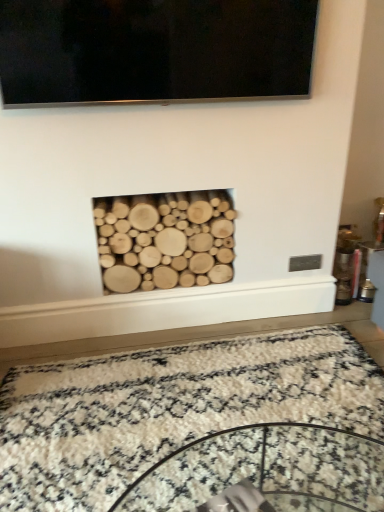
Describe the element at coordinates (169, 409) in the screenshot. This screenshot has height=512, width=384. I see `white shaggy rug at center` at that location.

This screenshot has height=512, width=384. Find the location of `white shaggy rug at center`. white shaggy rug at center is located at coordinates (169, 409).

From a real-world perspective, is black glossy flat-screen tv at upper center over white shaggy rug at center?

Yes.

Consider the image. From the image's perspective, relative to white shaggy rug at center, is black glossy flat-screen tv at upper center above or below?

black glossy flat-screen tv at upper center is situated higher than white shaggy rug at center in the image.

How many degrees apart are the facing directions of black glossy flat-screen tv at upper center and white shaggy rug at center?

0.0748 degrees separate the facing orientations of black glossy flat-screen tv at upper center and white shaggy rug at center.

Would you say black glossy flat-screen tv at upper center is outside white shaggy rug at center?

black glossy flat-screen tv at upper center is positioned outside white shaggy rug at center.

Between natural wood logs at center and white shaggy rug at center, which one appears on the left side from the viewer's perspective?

From the viewer's perspective, natural wood logs at center appears more on the left side.

Based on the photo, which is closer, (128, 209) or (315, 371)?

The point (315, 371) is closer.

Can you tell me how much natural wood logs at center and white shaggy rug at center differ in facing direction?

0.419 degrees.

Is white shaggy rug at center inside natural wood logs at center?

No, white shaggy rug at center is not surrounded by natural wood logs at center.

From a real-world perspective, relative to natural wood logs at center, is black glossy flat-screen tv at upper center vertically above or below?

In terms of real-world spatial position, black glossy flat-screen tv at upper center is above natural wood logs at center.

Consider the image. Considering the relative positions of black glossy flat-screen tv at upper center and natural wood logs at center in the image provided, is black glossy flat-screen tv at upper center to the right of natural wood logs at center from the viewer's perspective?

Yes, black glossy flat-screen tv at upper center is to the right of natural wood logs at center.

Considering the points (22, 86) and (219, 280), which point is in front, point (22, 86) or point (219, 280)?

The point (22, 86) is closer to the camera.

Does black glossy flat-screen tv at upper center lie behind natural wood logs at center?

No, the depth of black glossy flat-screen tv at upper center is less than that of natural wood logs at center.

From the image's perspective, which one is positioned higher, natural wood logs at center or black glossy flat-screen tv at upper center?

black glossy flat-screen tv at upper center appears higher in the image.

Considering the relative positions of natural wood logs at center and black glossy flat-screen tv at upper center in the image provided, is natural wood logs at center to the right of black glossy flat-screen tv at upper center from the viewer's perspective?

In fact, natural wood logs at center is to the left of black glossy flat-screen tv at upper center.

From a real-world perspective, is natural wood logs at center below black glossy flat-screen tv at upper center?

Indeed, from a real-world perspective, natural wood logs at center is positioned beneath black glossy flat-screen tv at upper center.

Identify the location of mat located below the natural wood logs at center (from the image's perspective). This screenshot has height=512, width=384. (169, 409).

Consider the image. Would you consider white shaggy rug at center to be distant from natural wood logs at center?

No, white shaggy rug at center is not far away from natural wood logs at center.

Measure the distance from white shaggy rug at center to natural wood logs at center.

21.86 inches.

Is white shaggy rug at center oriented towards natural wood logs at center?

No, white shaggy rug at center is not oriented towards natural wood logs at center.

Is white shaggy rug at center located outside black glossy flat-screen tv at upper center?

Yes, white shaggy rug at center is not within black glossy flat-screen tv at upper center.

At what (x,y) coordinates should I click in order to perform the action: click on mat located underneath the black glossy flat-screen tv at upper center (from a real-world perspective). Please return your answer as a coordinate pair (x, y). Looking at the image, I should click on (169, 409).

Between white shaggy rug at center and black glossy flat-screen tv at upper center, which one appears on the right side from the viewer's perspective?

From the viewer's perspective, white shaggy rug at center appears more on the right side.

From a real-world perspective, is white shaggy rug at center on top of black glossy flat-screen tv at upper center?

Actually, white shaggy rug at center is physically below black glossy flat-screen tv at upper center in the real world.

Where is `television located above the white shaggy rug at center (from a real-world perspective)`? The width and height of the screenshot is (384, 512). television located above the white shaggy rug at center (from a real-world perspective) is located at coordinates (154, 50).

The width and height of the screenshot is (384, 512). Identify the location of fireplace above the white shaggy rug at center (from the image's perspective). (165, 240).

Looking at the image, which one is located further to white shaggy rug at center, black glossy flat-screen tv at upper center or natural wood logs at center?

black glossy flat-screen tv at upper center is positioned further to the anchor white shaggy rug at center.

Looking at the image, which one is located further to natural wood logs at center, white shaggy rug at center or black glossy flat-screen tv at upper center?

Based on the image, black glossy flat-screen tv at upper center appears to be further to natural wood logs at center.

Based on their spatial positions, is natural wood logs at center or white shaggy rug at center further from black glossy flat-screen tv at upper center?

white shaggy rug at center is positioned further to the anchor black glossy flat-screen tv at upper center.

Estimate the real-world distances between objects in this image. Which object is closer to black glossy flat-screen tv at upper center, white shaggy rug at center or natural wood logs at center?

Among the two, natural wood logs at center is located nearer to black glossy flat-screen tv at upper center.

From the image, which object appears to be farther from natural wood logs at center, black glossy flat-screen tv at upper center or white shaggy rug at center?

The object further to natural wood logs at center is black glossy flat-screen tv at upper center.

Looking at the image, which one is located closer to white shaggy rug at center, natural wood logs at center or black glossy flat-screen tv at upper center?

Among the two, natural wood logs at center is located nearer to white shaggy rug at center.

In order to click on fireplace between black glossy flat-screen tv at upper center and white shaggy rug at center from top to bottom in this screenshot , I will do `click(165, 240)`.